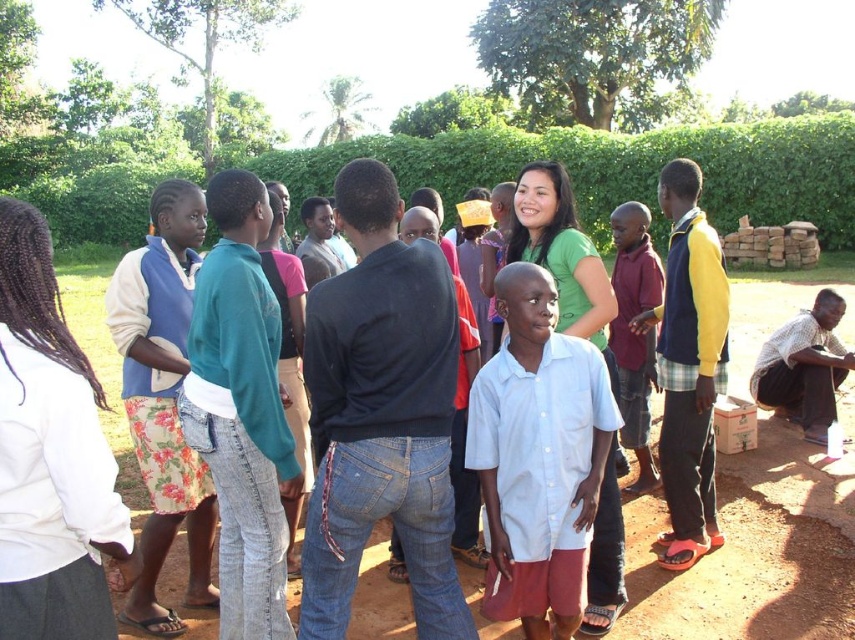
The width and height of the screenshot is (855, 640). What do you see at coordinates (538, 458) in the screenshot? I see `white cotton shirt at center` at bounding box center [538, 458].

Is point (526, 300) closer to viewer compared to point (258, 260)?

Yes.

I want to click on white cotton shirt at center, so click(538, 458).

Can you confirm if teal denim jeans at center is positioned to the right of floral skirt at left?

Correct, you'll find teal denim jeans at center to the right of floral skirt at left.

Based on the photo, which is below, teal denim jeans at center or floral skirt at left?

teal denim jeans at center is below.

Identify the location of teal denim jeans at center. (240, 410).

Does white cotton shirt at center come in front of floral skirt at left?

Yes, white cotton shirt at center is in front of floral skirt at left.

Is white cotton shirt at center positioned at the back of floral skirt at left?

No, white cotton shirt at center is closer to the viewer.

Who is more distant from viewer, (528, 572) or (178, 433)?

The point (178, 433) is behind.

Find the location of a particular element. This screenshot has height=640, width=855. white cotton shirt at center is located at coordinates 538,458.